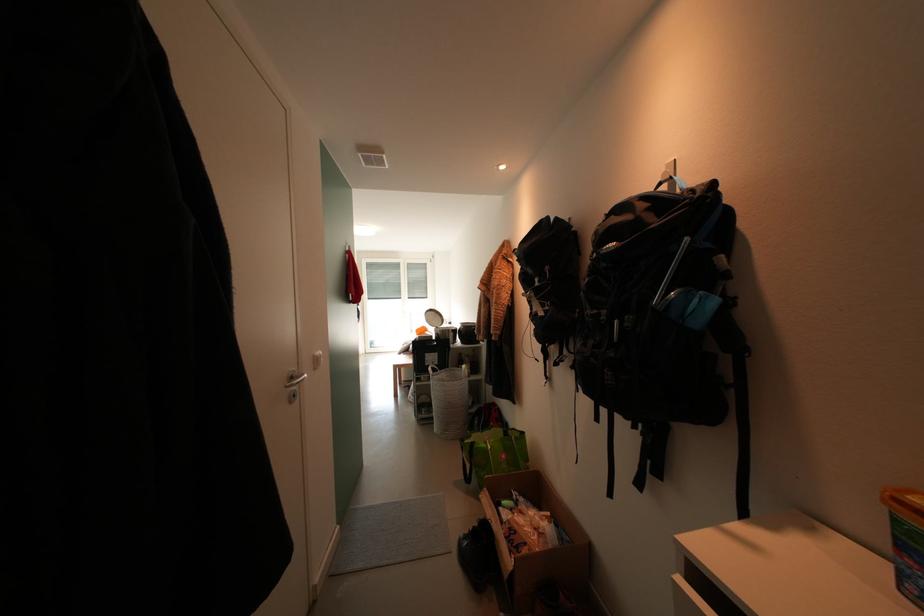
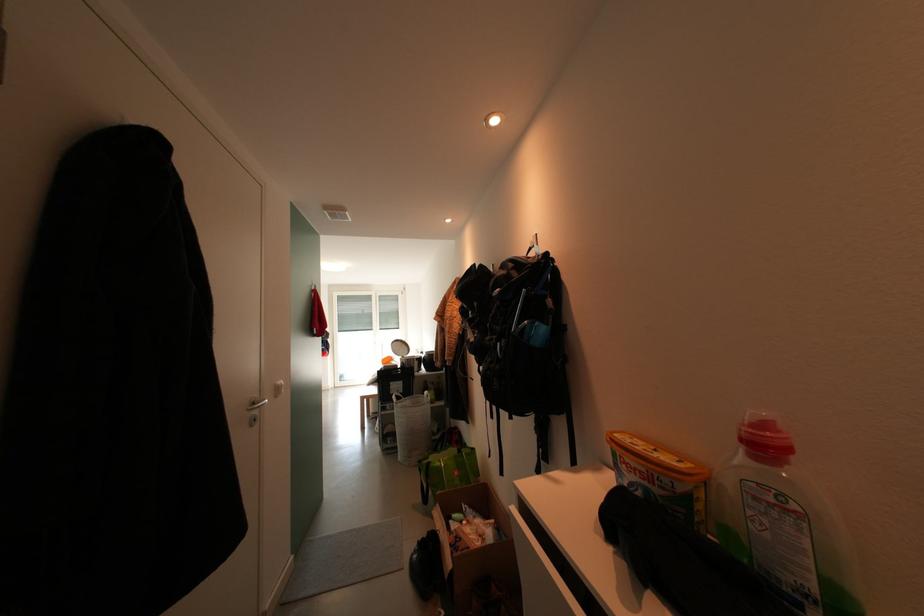
Locate, in the second image, the point that corresponds to point (299, 381) in the first image.

(261, 407)